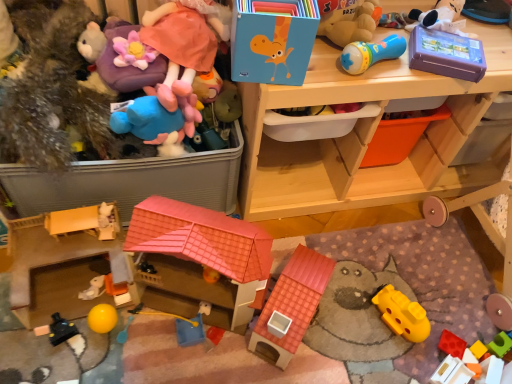
Find the location of `vacant space positioned to the left of wooden bunk bed at lower right`. vacant space positioned to the left of wooden bunk bed at lower right is located at coordinates pyautogui.click(x=401, y=266).